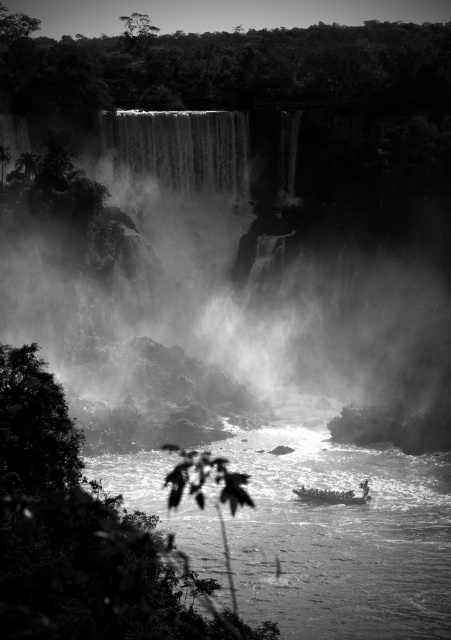
Is foggy mist at center positioned behind smooth water at lower center?

Yes, it is.

Which is behind, point (348, 257) or point (229, 452)?

The point (348, 257) is behind.

Locate an element on the screen. This screenshot has width=451, height=640. foggy mist at center is located at coordinates (230, 284).

Is foggy mist at center smaller than wooden boat at center?

No, foggy mist at center is not smaller than wooden boat at center.

Can you confirm if foggy mist at center is wider than wooden boat at center?

Yes.

Is point (101, 176) positioned after point (363, 488)?

That is True.

Locate an element on the screen. foggy mist at center is located at coordinates (230, 284).

Which of these two, smooth water at lower center or wooden boat at center, stands shorter?

Standing shorter between the two is wooden boat at center.

Between point (413, 506) and point (341, 497), which one is positioned in front?

Point (341, 497) is more forward.

Is point (440, 548) positioned after point (308, 496)?

No, it is in front of (308, 496).

At what (x,y) coordinates should I click in order to perform the action: click on smooth water at lower center. Please return your answer as a coordinate pair (x, y). Looking at the image, I should click on (341, 538).